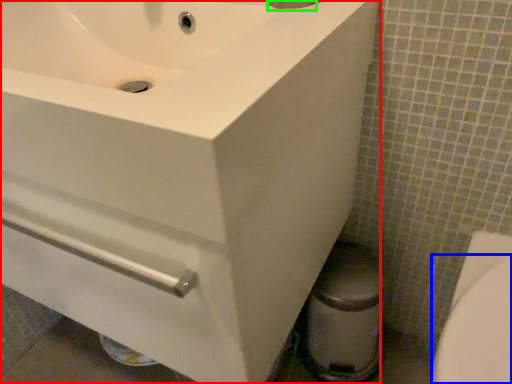
Question: Which is farther away from sink (highlighted by a red box)? bidet (highlighted by a blue box) or plumbing fixture (highlighted by a green box)?

Choices:
 (A) bidet
 (B) plumbing fixture

Answer: (A)